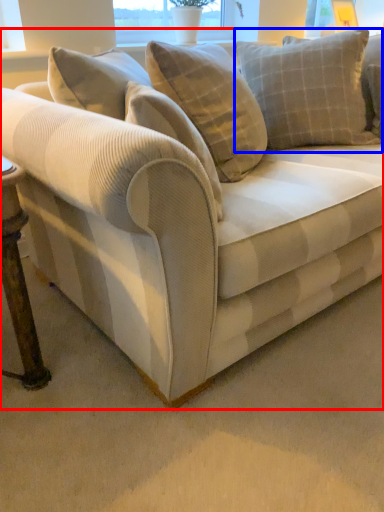
Question: Which object appears farthest to the camera in this image, studio couch (highlighted by a red box) or pillow (highlighted by a blue box)?

Choices:
 (A) studio couch
 (B) pillow

Answer: (B)